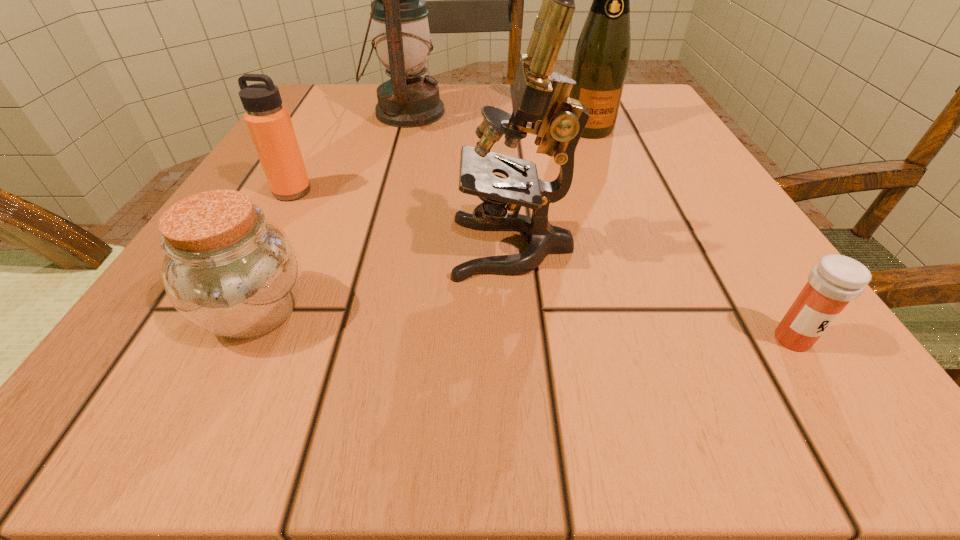
Identify the location of oil lamp located in the left edge section of the desktop. (402, 40).

Image resolution: width=960 pixels, height=540 pixels. I want to click on thermos bottle at the left edge, so click(x=268, y=121).

Find the location of a particular element. jar positioned at the left edge is located at coordinates (228, 270).

Identify the location of wine bottle located in the right edge section of the desktop. The height and width of the screenshot is (540, 960). (601, 58).

The height and width of the screenshot is (540, 960). In order to click on medicine that is at the right edge in this screenshot , I will do `click(836, 280)`.

This screenshot has width=960, height=540. Find the location of `object present at the far left corner`. object present at the far left corner is located at coordinates (402, 40).

At what (x,y) coordinates should I click in order to perform the action: click on object located at the near left corner. Please return your answer as a coordinate pair (x, y). This screenshot has width=960, height=540. Looking at the image, I should click on (228, 270).

Where is `object at the far right corner`? The width and height of the screenshot is (960, 540). object at the far right corner is located at coordinates (601, 58).

This screenshot has width=960, height=540. In order to click on object that is at the near right corner in this screenshot , I will do `click(836, 280)`.

The width and height of the screenshot is (960, 540). What are the coordinates of `vacant space at the far edge` in the screenshot? It's located at (455, 107).